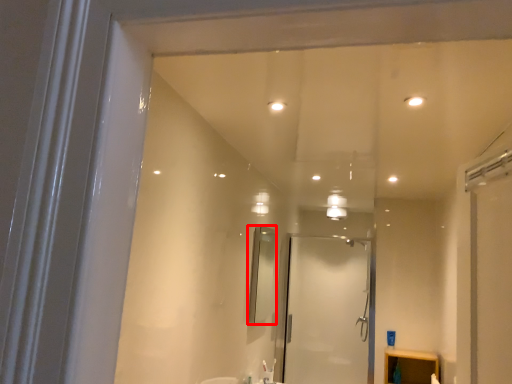
Question: From the image's perspective, what is the correct spatial relationship of mirror (annotated by the red box) in relation to screen door?

Choices:
 (A) below
 (B) above

Answer: (B)